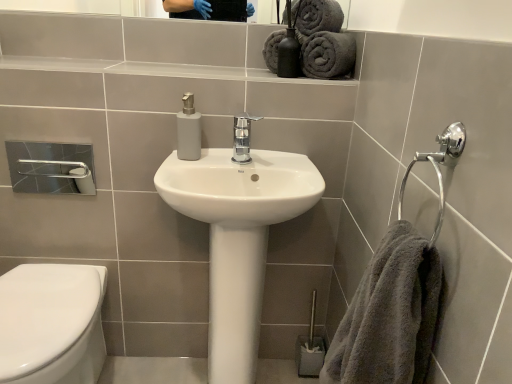
Where is `free space to the right of matte gray soap dispenser at center`? This screenshot has height=384, width=512. free space to the right of matte gray soap dispenser at center is located at coordinates (229, 156).